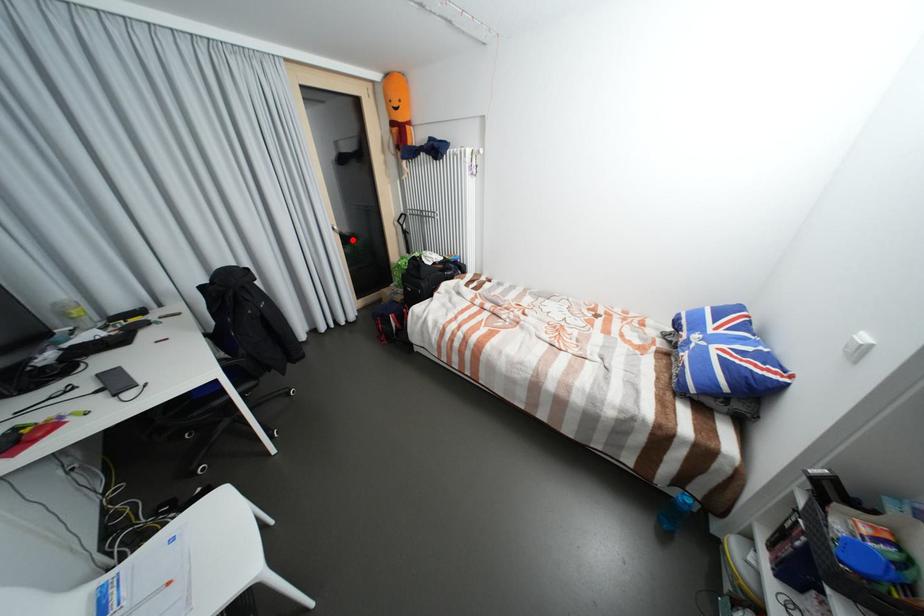
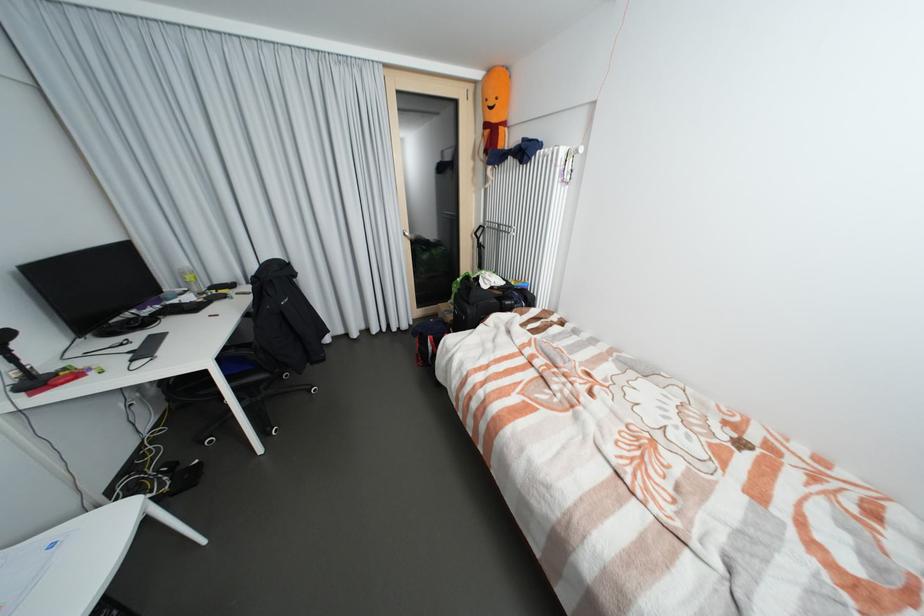
Find the pixel in the second image that matches the highlighted location in the first image.

(426, 246)